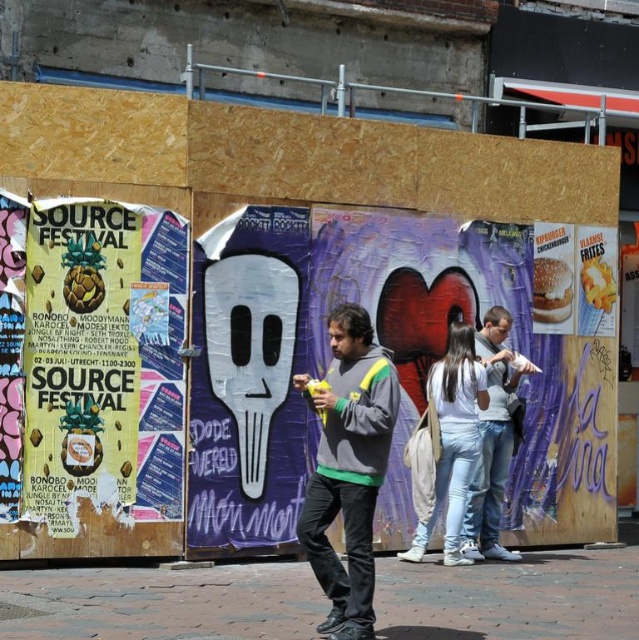
Question: Which object is positioned closest to the yellow paper poster at left?

Choices:
 (A) light blue jeans at center
 (B) white matte hoodie at center
 (C) gray fleece jacket at center

Answer: (A)

Question: Considering the relative positions of yellow paper poster at left and gray fleece jacket at center in the image provided, where is yellow paper poster at left located with respect to gray fleece jacket at center?

Choices:
 (A) right
 (B) left

Answer: (B)

Question: Based on their relative distances, which object is nearer to the white matte hoodie at center?

Choices:
 (A) light blue jeans at center
 (B) gray fleece jacket at center

Answer: (A)

Question: Is the position of gray fleece jacket at center less distant than that of light blue jeans at center?

Choices:
 (A) yes
 (B) no

Answer: (A)

Question: Among these objects, which one is farthest from the camera?

Choices:
 (A) white matte hoodie at center
 (B) light blue jeans at center

Answer: (A)

Question: Is light blue jeans at center closer to camera compared to white matte hoodie at center?

Choices:
 (A) yes
 (B) no

Answer: (A)